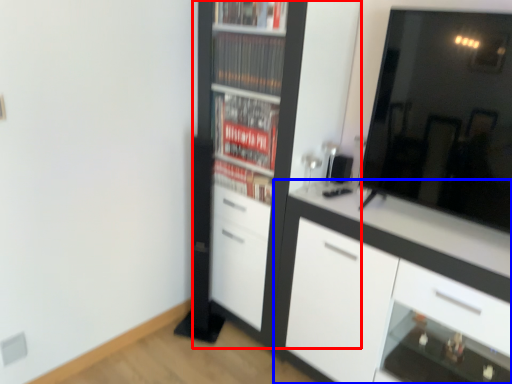
Question: Which object appears farthest to the camera in this image, cupboard (highlighted by a red box) or cabinetry (highlighted by a blue box)?

Choices:
 (A) cupboard
 (B) cabinetry

Answer: (A)